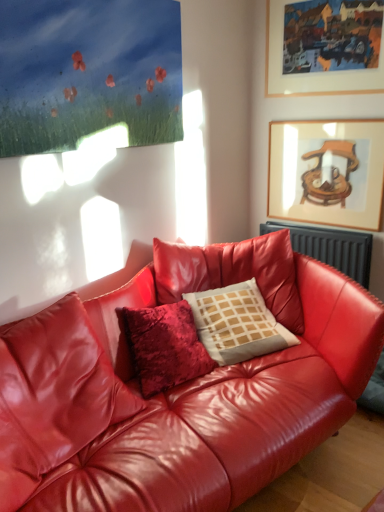
Question: Would you say wooden-framed painting at upper right, the 1th picture frame when ordered from top to bottom, is to the left or to the right of shiny red leather couch at center in the picture?

Choices:
 (A) right
 (B) left

Answer: (A)

Question: In terms of size, does wooden-framed painting at upper right, the 1th picture frame when ordered from top to bottom, appear bigger or smaller than shiny red leather couch at center?

Choices:
 (A) small
 (B) big

Answer: (A)

Question: Which of these objects is positioned closest to the black metallic radiator at upper right?

Choices:
 (A) matte wooden picture frame at upper right, which is counted as the first picture frame, starting from the bottom
 (B) white textured pillow at center
 (C) shiny red leather couch at center
 (D) wooden-framed painting at upper right, placed as the second picture frame when sorted from bottom to top

Answer: (A)

Question: Considering the real-world distances, which object is farthest from the wooden-framed painting at upper right, placed as the second picture frame when sorted from bottom to top?

Choices:
 (A) shiny red leather couch at center
 (B) matte wooden picture frame at upper right, which is counted as the first picture frame, starting from the bottom
 (C) black metallic radiator at upper right
 (D) white textured pillow at center

Answer: (A)